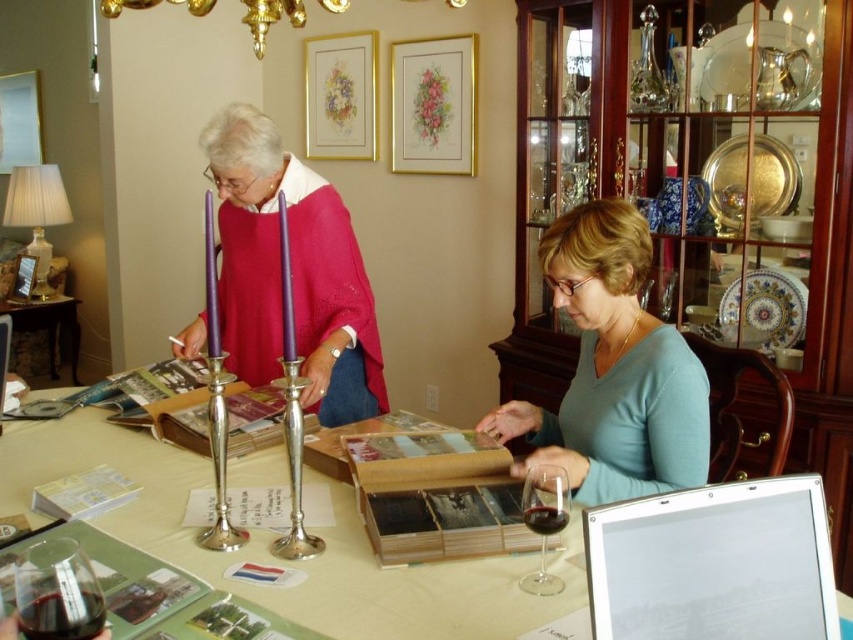
Who is more distant from viewer, (662, 449) or (628, 284)?

Point (628, 284)

Who is shorter, matte pink sweater at center or blue matte shirt at center?

blue matte shirt at center

Who is more forward, (674, 385) or (573, 211)?

Positioned in front is point (674, 385).

This screenshot has width=853, height=640. Find the location of `matte pink sweater at center`. matte pink sweater at center is located at coordinates (614, 372).

Measure the distance between pink sweater at center and camera.

The distance of pink sweater at center from camera is 5.94 feet.

Consider the image. Can you confirm if pink sweater at center is positioned to the right of translucent glass wine glass at lower left?

Yes, pink sweater at center is to the right of translucent glass wine glass at lower left.

Identify the location of pink sweater at center. (291, 272).

Does matte pink sweater at center appear on the right side of pink sweater at center?

No, matte pink sweater at center is not to the right of pink sweater at center.

Who is more forward, [590,332] or [250,276]?

Point [590,332] is more forward.

Is point (589, 246) closer to viewer compared to point (219, 218)?

Yes, point (589, 246) is closer to viewer.

In order to click on matte pink sweater at center in this screenshot , I will do `click(614, 372)`.